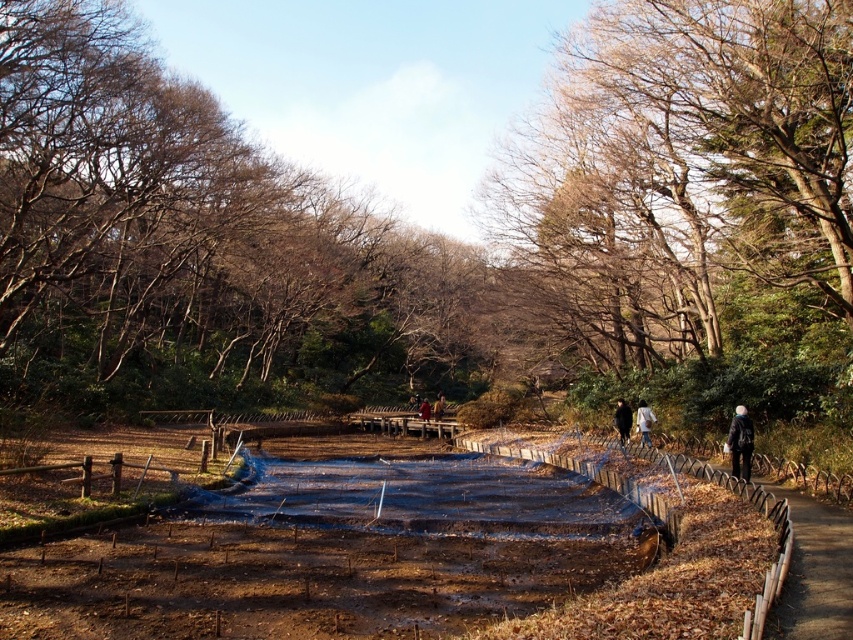
Is transparent plastic puddle at center bigger than yellow fabric bag at center?

Yes.

Does transparent plastic puddle at center have a lesser width compared to yellow fabric bag at center?

No.

This screenshot has width=853, height=640. What do you see at coordinates (421, 497) in the screenshot?
I see `transparent plastic puddle at center` at bounding box center [421, 497].

Locate an element on the screen. transparent plastic puddle at center is located at coordinates pos(421,497).

Is brown leafless branches at upper center closer to camera compared to light brown fabric jacket at center?

Yes, it is in front of light brown fabric jacket at center.

Which of these two, brown leafless branches at upper center or light brown fabric jacket at center, stands shorter?

light brown fabric jacket at center

Between point (30, 332) and point (647, 433), which one is positioned in front?

Point (647, 433) is in front.

Where is `brown leafless branches at upper center`? This screenshot has width=853, height=640. brown leafless branches at upper center is located at coordinates (193, 243).

Is black matte jacket at center-right bigger than yellow fabric bag at center?

No, black matte jacket at center-right is not bigger than yellow fabric bag at center.

Does black matte jacket at center-right have a lesser height compared to yellow fabric bag at center?

Correct, black matte jacket at center-right is not as tall as yellow fabric bag at center.

Image resolution: width=853 pixels, height=640 pixels. What do you see at coordinates (622, 420) in the screenshot? I see `black matte jacket at center-right` at bounding box center [622, 420].

Where is `black matte jacket at center-right`? This screenshot has height=640, width=853. black matte jacket at center-right is located at coordinates (622, 420).